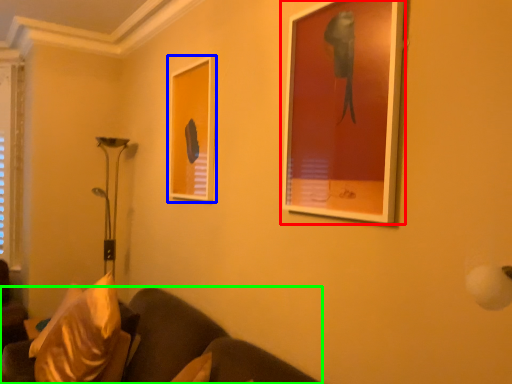
Question: Which object is the closest to the picture frame (highlighted by a red box)? Choose among these: picture frame (highlighted by a blue box) or studio couch (highlighted by a green box).

Choices:
 (A) picture frame
 (B) studio couch

Answer: (A)